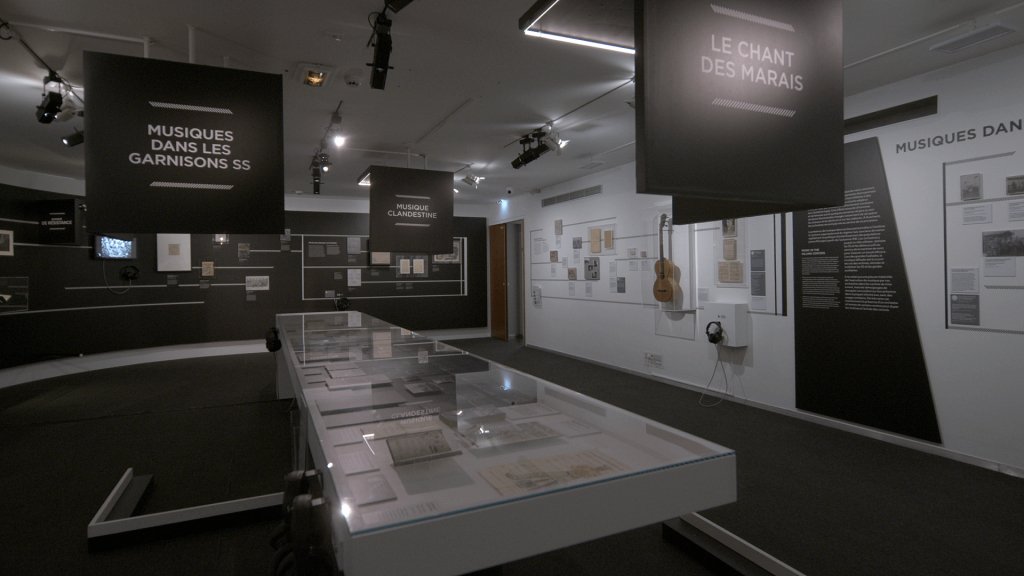
Where is `doorway`? doorway is located at coordinates (515, 280).